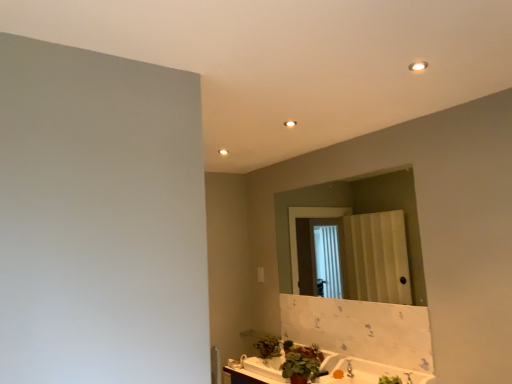
Question: Is white glossy countertop at lower center outside green matte plant at lower center, the 2th plant in the front-to-back sequence?

Choices:
 (A) yes
 (B) no

Answer: (A)

Question: Is green matte plant at lower center, the 2th plant in the front-to-back sequence, inside white glossy countertop at lower center?

Choices:
 (A) no
 (B) yes

Answer: (A)

Question: Is white glossy countertop at lower center facing away from green matte plant at lower center, acting as the second plant starting from the back?

Choices:
 (A) yes
 (B) no

Answer: (B)

Question: From the image's perspective, is white glossy countertop at lower center located above green matte plant at lower center, the 2th plant in the front-to-back sequence?

Choices:
 (A) yes
 (B) no

Answer: (B)

Question: Considering the relative sizes of white glossy countertop at lower center and green matte plant at lower center, the 2th plant in the front-to-back sequence, in the image provided, is white glossy countertop at lower center shorter than green matte plant at lower center, the 2th plant in the front-to-back sequence,?

Choices:
 (A) yes
 (B) no

Answer: (B)

Question: Based on their positions, is white glossy light fixture at upper right located to the left or right of silver metallic faucet at lower center?

Choices:
 (A) left
 (B) right

Answer: (B)

Question: From the image's perspective, is white glossy light fixture at upper right positioned above or below silver metallic faucet at lower center?

Choices:
 (A) above
 (B) below

Answer: (A)

Question: Is white glossy light fixture at upper right wider or thinner than silver metallic faucet at lower center?

Choices:
 (A) thin
 (B) wide

Answer: (A)

Question: Is point (412, 69) positioned closer to the camera than point (350, 372)?

Choices:
 (A) closer
 (B) farther

Answer: (A)

Question: In terms of width, does green matte plant at lower center, the third plant positioned from the back, look wider or thinner when compared to matte glass mirror at center?

Choices:
 (A) wide
 (B) thin

Answer: (A)

Question: Which is correct: green matte plant at lower center, the third plant positioned from the back, is inside matte glass mirror at center, or outside of it?

Choices:
 (A) outside
 (B) inside

Answer: (A)

Question: Considering the positions of green matte plant at lower center, the third plant positioned from the back, and matte glass mirror at center in the image, is green matte plant at lower center, the third plant positioned from the back, taller or shorter than matte glass mirror at center?

Choices:
 (A) tall
 (B) short

Answer: (B)

Question: Would you say green matte plant at lower center, the 1th plant positioned from the front, is to the left or to the right of matte glass mirror at center in the picture?

Choices:
 (A) left
 (B) right

Answer: (A)

Question: From a real-world perspective, is green matte plant at lower center, the third plant positioned from the back, positioned above or below white glossy countertop at lower center?

Choices:
 (A) above
 (B) below

Answer: (A)

Question: In terms of size, does green matte plant at lower center, the 1th plant positioned from the front, appear bigger or smaller than white glossy countertop at lower center?

Choices:
 (A) small
 (B) big

Answer: (A)